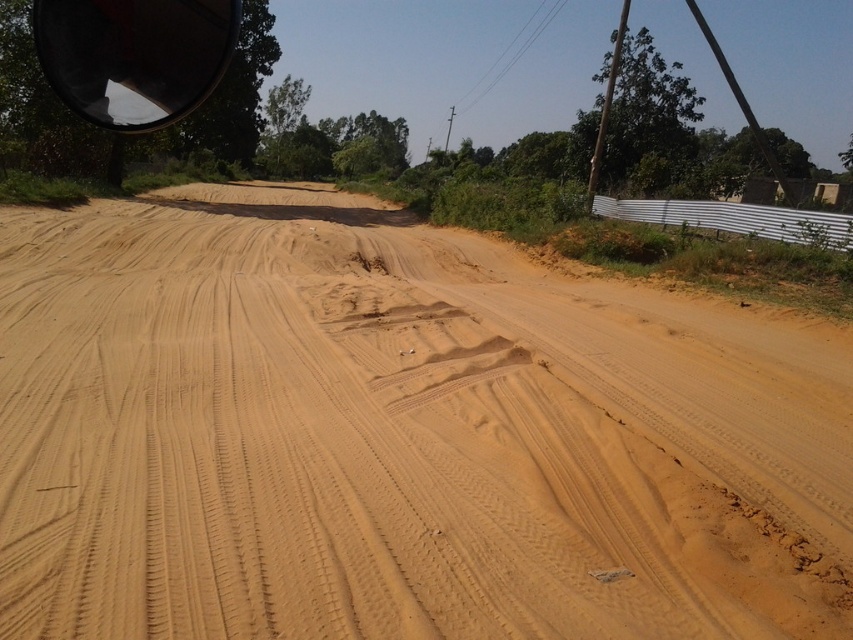
Is brown sandy dirt at center above black reflective view mirror at upper left?

No, brown sandy dirt at center is not above black reflective view mirror at upper left.

You are a GUI agent. You are given a task and a screenshot of the screen. Output one action in this format:
    pyautogui.click(x=<x>, y=<y>)
    Task: Click on the brown sandy dirt at center
    The width and height of the screenshot is (853, 640).
    Given the screenshot: What is the action you would take?
    pyautogui.click(x=395, y=436)